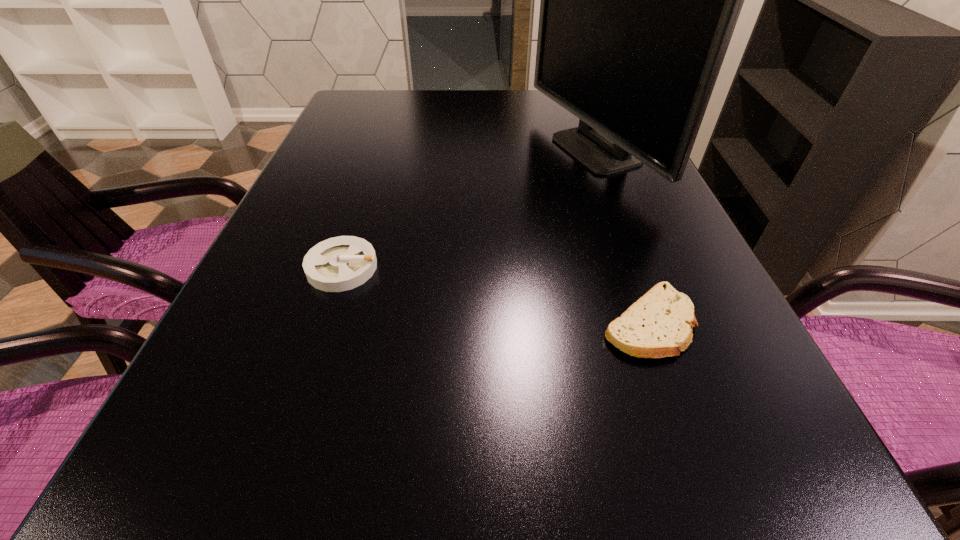
Image resolution: width=960 pixels, height=540 pixels. Identify the location of the tallest object. (639, 0).

Where is `computer monitor`? computer monitor is located at coordinates (639, 0).

Find the location of `the leftmost object`. the leftmost object is located at coordinates click(337, 264).

Identify the location of ashtray. (337, 264).

The width and height of the screenshot is (960, 540). What are the coordinates of `pita bread` in the screenshot? It's located at (655, 326).

The image size is (960, 540). Identify the location of free location located on the front-facing side of the tallest object. (509, 151).

At what (x,y) coordinates should I click in order to perform the action: click on vacant space situated on the front-facing side of the tallest object. Please return your answer as a coordinate pair (x, y). Looking at the image, I should click on (437, 151).

This screenshot has width=960, height=540. I want to click on blank space located 0.060m on the front-facing side of the tallest object, so click(x=516, y=151).

I want to click on free location located 0.220m on the back of the second tallest object, so click(x=370, y=183).

You are a GUI agent. You are given a task and a screenshot of the screen. Output one action in this format:
    pyautogui.click(x=<x>, y=<y>)
    Task: Click on the vacant space located on the back of the pita bread
    The width and height of the screenshot is (960, 540).
    Given the screenshot: What is the action you would take?
    pyautogui.click(x=619, y=241)